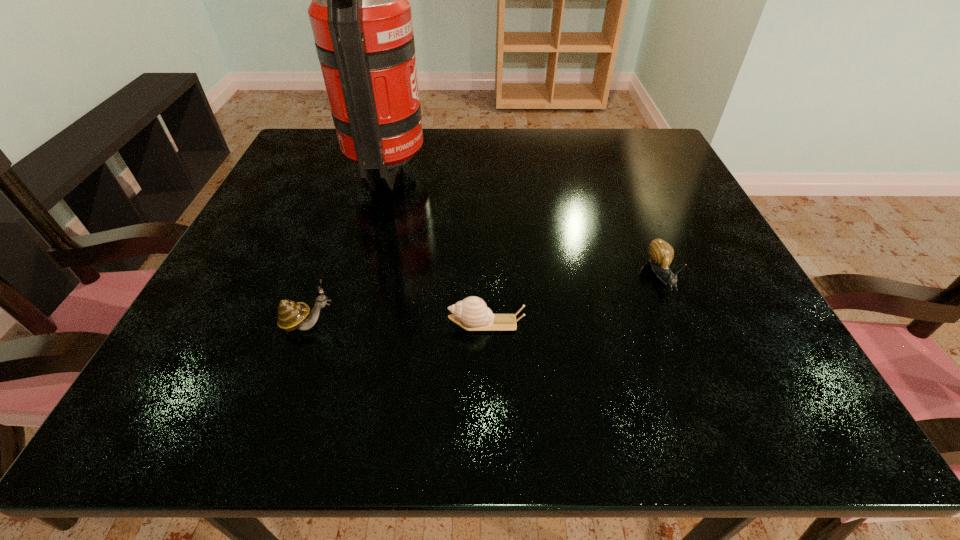
Locate an element on the screen. the tallest object is located at coordinates (360, 16).

The image size is (960, 540). What are the coordinates of `the farthest object` in the screenshot? It's located at (360, 16).

In order to click on the leftmost escargot in this screenshot , I will do `click(291, 315)`.

This screenshot has height=540, width=960. Find the location of `the third shortest object`. the third shortest object is located at coordinates (291, 315).

This screenshot has width=960, height=540. What are the coordinates of `the rightmost escargot` in the screenshot? It's located at (661, 253).

At what (x,y) coordinates should I click in order to perform the action: click on the second farthest object. Please return your answer as a coordinate pair (x, y). Image resolution: width=960 pixels, height=540 pixels. Looking at the image, I should click on (661, 253).

This screenshot has width=960, height=540. I want to click on the third object from left to right, so click(x=472, y=314).

You are a GUI agent. You are given a task and a screenshot of the screen. Output one action in this format:
    pyautogui.click(x=<x>, y=<y>)
    Task: Click on the blank space located on the front label side of the tallest object
    This screenshot has height=540, width=960.
    Given the screenshot: What is the action you would take?
    pyautogui.click(x=497, y=166)

You are a GUI agent. You are given a task and a screenshot of the screen. Output one action in this format:
    pyautogui.click(x=<x>, y=<y>)
    Task: Click on the free space located 0.310m on the face of the tallest escargot
    
    Given the screenshot: What is the action you would take?
    pyautogui.click(x=540, y=325)

Locate an element on the screen. The image size is (960, 540). free spot located on the front-facing side of the rightmost escargot is located at coordinates (702, 373).